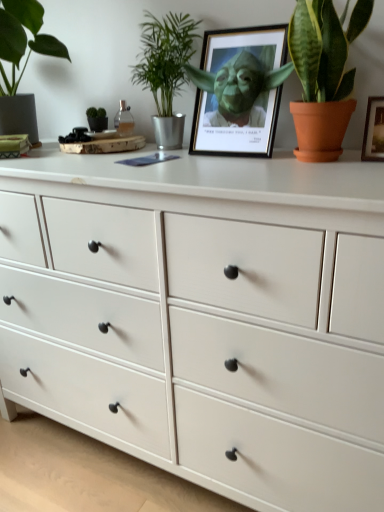
The height and width of the screenshot is (512, 384). Find the location of `vacant area that is in front of matte black picture frame at center`. vacant area that is in front of matte black picture frame at center is located at coordinates (248, 163).